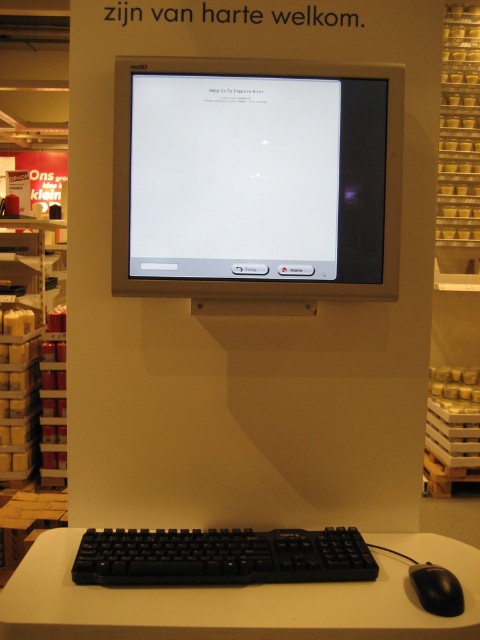
Identify the location of matte silver monitor at center. Image resolution: width=480 pixels, height=640 pixels. (255, 179).

Which is in front, point (242, 72) or point (421, 589)?

Positioned in front is point (421, 589).

Identify the location of matte silver monitor at center. (255, 179).

Who is taller, matte silver monitor at center or black plastic keyboard at lower center?

matte silver monitor at center is taller.

Locate an element on the screen. The image size is (480, 640). matte silver monitor at center is located at coordinates (255, 179).

Is point (237, 289) positioned before point (230, 545)?

No.

Find the location of `matte silver monitor at center`. matte silver monitor at center is located at coordinates click(255, 179).

Looking at this image, between white plastic table at center and black plastic keyboard at lower center, which one appears on the left side from the viewer's perspective?

From the viewer's perspective, black plastic keyboard at lower center appears more on the left side.

Looking at this image, between white plastic table at center and black plastic keyboard at lower center, which one is positioned lower?

white plastic table at center is lower down.

Where is `white plastic table at center`? Image resolution: width=480 pixels, height=640 pixels. white plastic table at center is located at coordinates (236, 600).